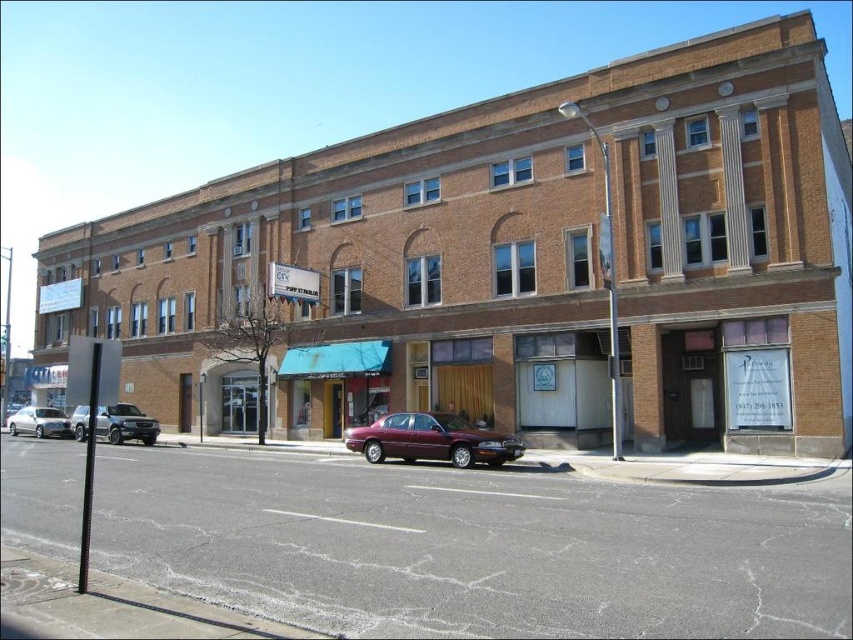
Who is positioned more to the left, maroon metallic sedan at center or satin silver suv at left?

Positioned to the left is satin silver suv at left.

Is point (451, 445) behind point (77, 432)?

No, (451, 445) is in front of (77, 432).

Find the location of a particular element. The image size is (853, 640). maroon metallic sedan at center is located at coordinates (431, 440).

Measure the distance between point (103,424) and camera.

They are 29.54 meters apart.

Can you confirm if satin silver suv at left is positioned below silver metallic sedan at left?

Incorrect, satin silver suv at left is not positioned below silver metallic sedan at left.

The height and width of the screenshot is (640, 853). Describe the element at coordinates (125, 422) in the screenshot. I see `satin silver suv at left` at that location.

Locate an element on the screen. satin silver suv at left is located at coordinates (125, 422).

Is point (363, 451) closer to viewer compared to point (22, 412)?

Yes, point (363, 451) is closer to viewer.

Between maroon metallic sedan at center and silver metallic sedan at left, which one appears on the right side from the viewer's perspective?

From the viewer's perspective, maroon metallic sedan at center appears more on the right side.

Describe the element at coordinates (431, 440) in the screenshot. I see `maroon metallic sedan at center` at that location.

At what (x,y) coordinates should I click in order to perform the action: click on maroon metallic sedan at center. Please return your answer as a coordinate pair (x, y). The width and height of the screenshot is (853, 640). Looking at the image, I should click on (431, 440).